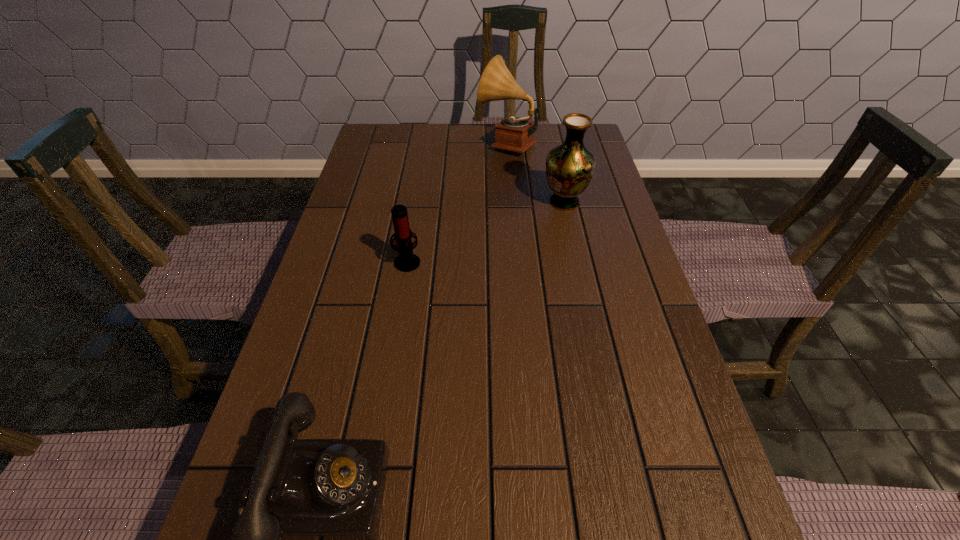
Identify the location of the farthest object. The image size is (960, 540). (513, 134).

Image resolution: width=960 pixels, height=540 pixels. Find the location of `the third nearest object`. the third nearest object is located at coordinates (570, 166).

This screenshot has height=540, width=960. Find the location of `microphone`. microphone is located at coordinates (406, 261).

This screenshot has height=540, width=960. What are the coordinates of `vacant space located 0.120m on the horn of the farthest object` in the screenshot? It's located at (442, 143).

The height and width of the screenshot is (540, 960). I want to click on vacant space located 0.160m on the horn of the farthest object, so click(x=429, y=143).

This screenshot has height=540, width=960. In order to click on free point located 0.330m on the horn of the farthest object in this screenshot , I will do `click(378, 143)`.

Where is `vacant region located on the left of the vase`? The width and height of the screenshot is (960, 540). vacant region located on the left of the vase is located at coordinates (457, 202).

Where is `vacant space located on the back of the microphone`? The width and height of the screenshot is (960, 540). vacant space located on the back of the microphone is located at coordinates (412, 238).

Identify the location of object located at the far edge. (513, 134).

At what (x,y) coordinates should I click in order to perform the action: click on object that is at the right edge. Please return your answer as a coordinate pair (x, y). Looking at the image, I should click on (570, 166).